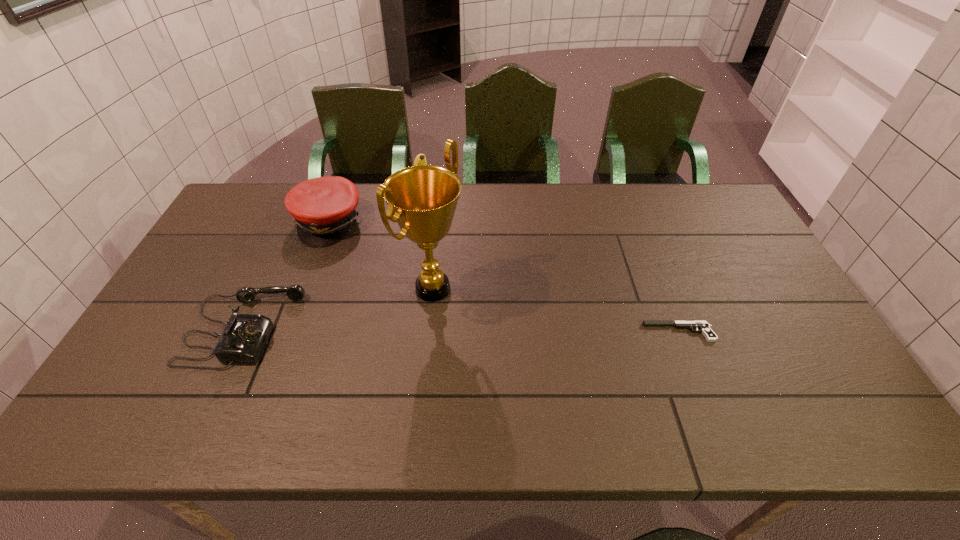
Locate an element on the screen. free space that satisfies the following two spatial constraints: 1. on the front side of the second tallest object; 2. on the left side of the tallest object is located at coordinates (411, 288).

Identify the location of vacant area that satisfies the following two spatial constraints: 1. on the back side of the cap; 2. on the left side of the fourth shortest object. (338, 198).

Find the location of a particular element. This screenshot has height=540, width=960. free space that satisfies the following two spatial constraints: 1. on the front side of the shortest object; 2. on the front-facing side of the tallest object is located at coordinates [x=428, y=332].

Where is `blank space that satisfies the following two spatial constraints: 1. on the front side of the banana; 2. on the front-facing side of the pistol`? The image size is (960, 540). blank space that satisfies the following two spatial constraints: 1. on the front side of the banana; 2. on the front-facing side of the pistol is located at coordinates (404, 332).